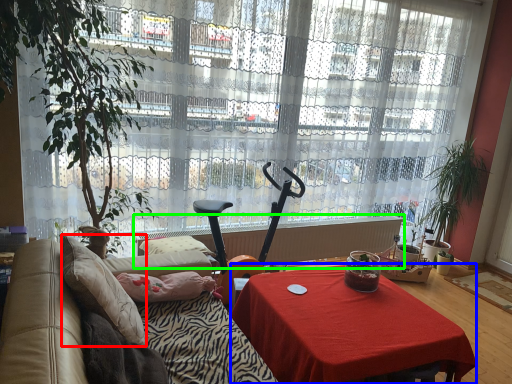
Question: Based on their relative distances, which object is farther from pillow (highlighted by a red box)? Choose from desk (highlighted by a blue box) and radiator (highlighted by a green box).

Choices:
 (A) desk
 (B) radiator

Answer: (B)